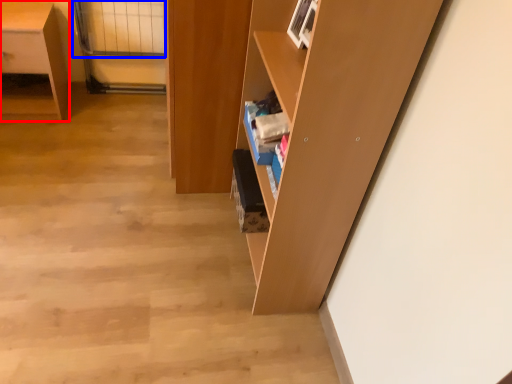
Question: Which object is closer to the camera taking this photo, desk (highlighted by a red box) or glass door (highlighted by a blue box)?

Choices:
 (A) desk
 (B) glass door

Answer: (A)